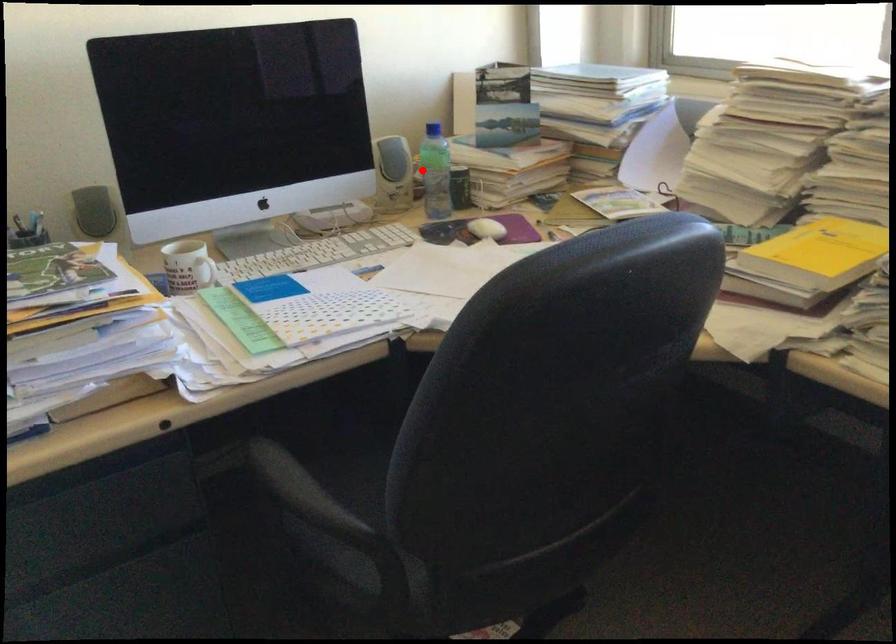
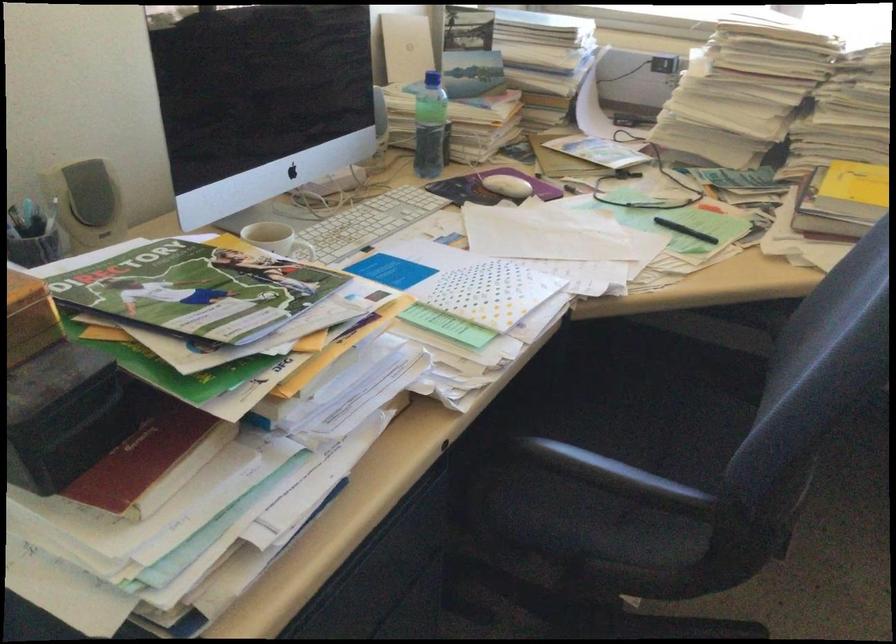
Locate, in the second image, the point that corresponds to the highlighted location in the first image.

(428, 126)